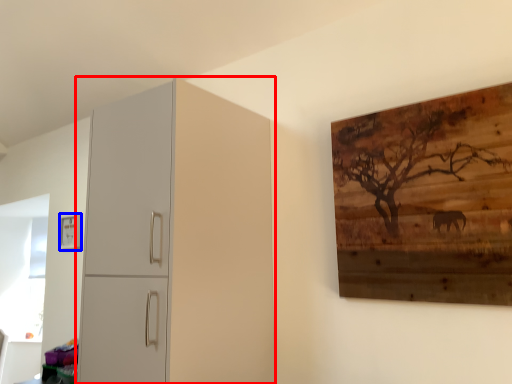
Question: Which object appears farthest to the camera in this image, cupboard (highlighted by a red box) or picture frame (highlighted by a blue box)?

Choices:
 (A) cupboard
 (B) picture frame

Answer: (B)